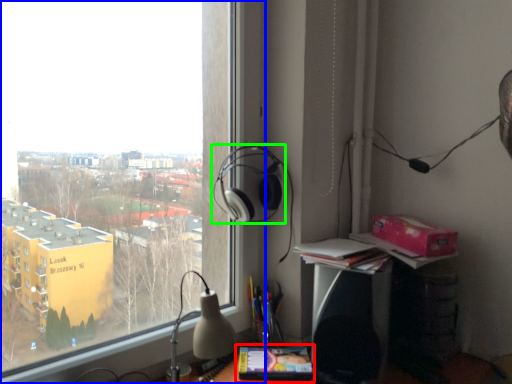
Question: Considering the real-world distances, which object is closest to paperback book (highlighted by a red box)? window (highlighted by a blue box) or headphones (highlighted by a green box).

Choices:
 (A) window
 (B) headphones

Answer: (B)